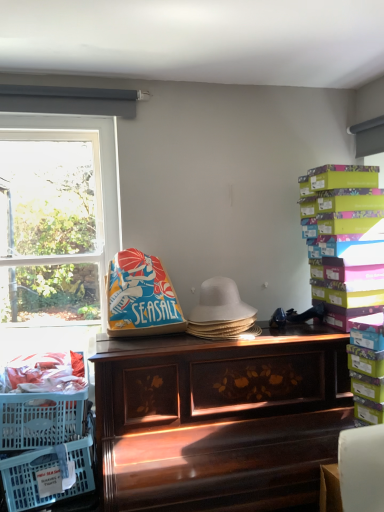
Question: Considering the relative sizes of wooden piano at center and translucent plastic crate at lower left in the image provided, is wooden piano at center smaller than translucent plastic crate at lower left?

Choices:
 (A) no
 (B) yes

Answer: (A)

Question: From the image's perspective, is wooden piano at center located beneath translucent plastic crate at lower left?

Choices:
 (A) yes
 (B) no

Answer: (A)

Question: Is wooden piano at center at the left side of translucent plastic crate at lower left?

Choices:
 (A) yes
 (B) no

Answer: (B)

Question: Considering the relative positions of wooden piano at center and translucent plastic crate at lower left in the image provided, is wooden piano at center to the right of translucent plastic crate at lower left from the viewer's perspective?

Choices:
 (A) yes
 (B) no

Answer: (A)

Question: From the image's perspective, is wooden piano at center on top of translucent plastic crate at lower left?

Choices:
 (A) no
 (B) yes

Answer: (A)

Question: Could you tell me if wooden piano at center is turned towards translucent plastic crate at lower left?

Choices:
 (A) no
 (B) yes

Answer: (A)

Question: Is wooden piano at center shorter than multicolored cardboard boxes at right?

Choices:
 (A) yes
 (B) no

Answer: (B)

Question: From a real-world perspective, is wooden piano at center physically above multicolored cardboard boxes at right?

Choices:
 (A) no
 (B) yes

Answer: (A)

Question: Is wooden piano at center directly adjacent to multicolored cardboard boxes at right?

Choices:
 (A) no
 (B) yes

Answer: (A)

Question: Considering the relative sizes of wooden piano at center and multicolored cardboard boxes at right in the image provided, is wooden piano at center bigger than multicolored cardboard boxes at right?

Choices:
 (A) yes
 (B) no

Answer: (A)

Question: From the image's perspective, is wooden piano at center beneath multicolored cardboard boxes at right?

Choices:
 (A) yes
 (B) no

Answer: (A)

Question: Is wooden piano at center looking in the opposite direction of multicolored cardboard boxes at right?

Choices:
 (A) yes
 (B) no

Answer: (B)

Question: Is translucent plastic crate at lower left thinner than white woven hat at center?

Choices:
 (A) yes
 (B) no

Answer: (B)